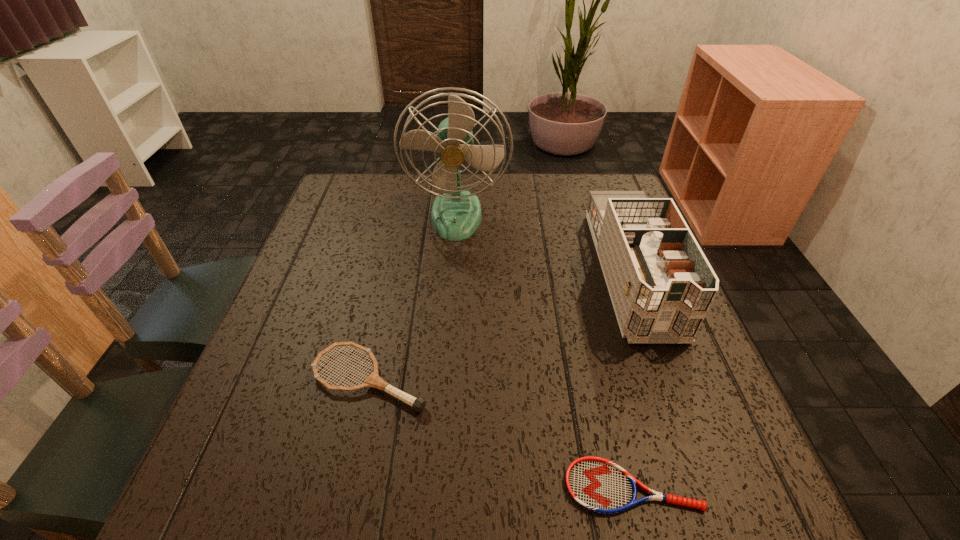
Identify the location of blank region between the fan and the dollhouse. This screenshot has width=960, height=540. (543, 244).

Find the location of `empty space that is in between the right tennis racket and the tallest object`. empty space that is in between the right tennis racket and the tallest object is located at coordinates (544, 350).

This screenshot has width=960, height=540. I want to click on vacant space that is in between the dollhouse and the farther tennis racket, so click(x=500, y=325).

What are the coordinates of `vacant space that's between the nearer tennis racket and the third shortest object` in the screenshot? It's located at (631, 379).

Find the location of a particular element. the closest object to the fan is located at coordinates (661, 285).

Where is `object that stands as the second closest to the dollhouse`? This screenshot has height=540, width=960. object that stands as the second closest to the dollhouse is located at coordinates (596, 484).

Where is `free space that satisfies the following two spatial constraints: 1. in front of the fan, directing airflow; 2. on the left side of the shortest object`? This screenshot has height=540, width=960. free space that satisfies the following two spatial constraints: 1. in front of the fan, directing airflow; 2. on the left side of the shortest object is located at coordinates (439, 486).

Identify the location of vacant space that satisfies the following two spatial constraints: 1. in front of the right tennis racket, directing airflow; 2. on the left side of the tallest object. The image size is (960, 540). (439, 486).

Find the location of a particular element. vacant space that satisfies the following two spatial constraints: 1. on the front side of the shorter tennis racket; 2. on the right side of the third tallest object is located at coordinates (347, 486).